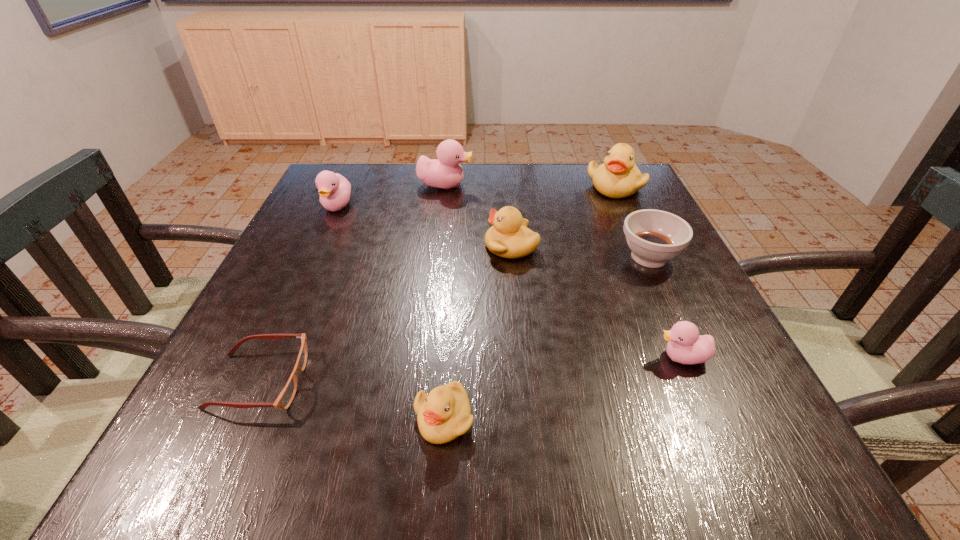
Where is `object that is at the far left corner`? object that is at the far left corner is located at coordinates (334, 189).

Where is `object at the far right corner`? object at the far right corner is located at coordinates (618, 177).

Identify the location of vacant space at the far edge of the desktop. Image resolution: width=960 pixels, height=540 pixels. (552, 173).

At what (x,y) coordinates should I click in order to perform the action: click on free space at the near edge of the desktop. Please return your answer as a coordinate pair (x, y). Image resolution: width=960 pixels, height=540 pixels. Looking at the image, I should click on (574, 435).

Find the location of a particular element. free space at the left edge of the desktop is located at coordinates (328, 273).

In order to click on vacant region at the right edge of the desktop in this screenshot , I will do `click(696, 364)`.

Identify the location of free point at the near left corner. (207, 460).

In the image, there is a desktop. Where is `vacant region at the far right corner`? Image resolution: width=960 pixels, height=540 pixels. vacant region at the far right corner is located at coordinates (583, 174).

Identify the location of free space between the nearest duckling and the second biggest pink duckling. The width and height of the screenshot is (960, 540). (391, 312).

At what (x,y) coordinates should I click in order to perform the action: click on empty space that is in between the brown spectacles and the soup bowl. Please return your answer as a coordinate pair (x, y). The width and height of the screenshot is (960, 540). Looking at the image, I should click on (454, 319).